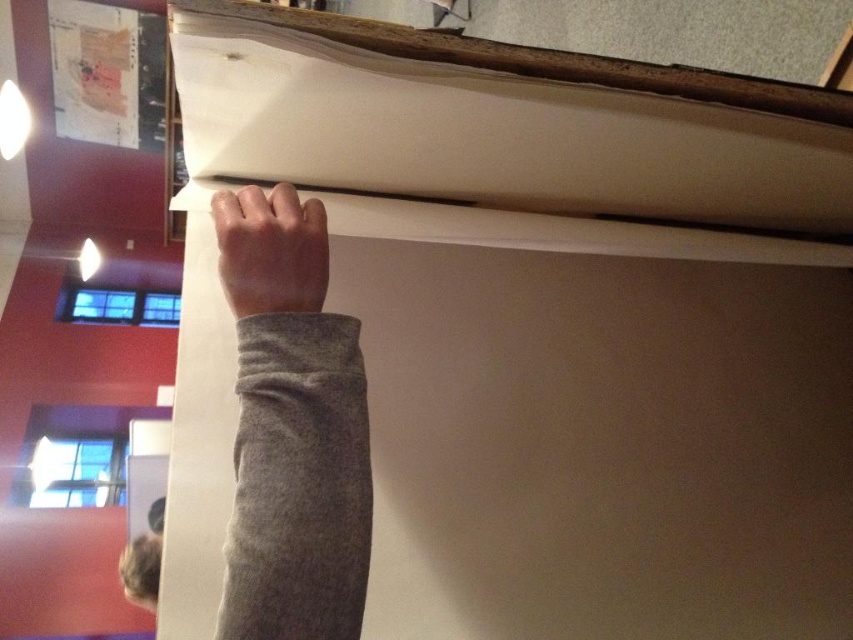
You are a tailor measuring the distance between the gray fleece arm at upper center and the smooth gray hand at upper center. The minimum required space for a comfortable fit is 1 inch. Is the current distance sufficient?

The distance between the gray fleece arm at upper center and the smooth gray hand at upper center is 0.91 inches, which is less than the required 1 inch for a comfortable fit. Therefore, the current distance is insufficient.

You are an artist trying to hang a picture frame. You see the gray fleece arm at upper center and the smooth gray hand at upper center. Which part of your body is higher in this scene?

The gray fleece arm at upper center is higher than the smooth gray hand at upper center in this scene.